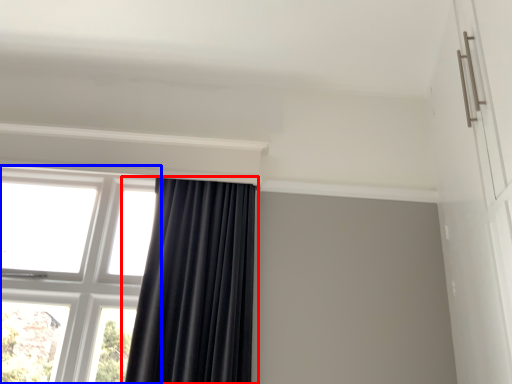
Question: Which point is closer to the camera, curtain (highlighted by a red box) or window (highlighted by a blue box)?

Choices:
 (A) curtain
 (B) window

Answer: (A)